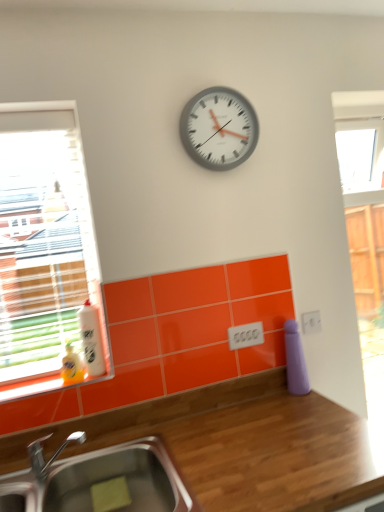
Question: From a real-world perspective, is wooden at upper center physically above clear glass window at left?

Choices:
 (A) yes
 (B) no

Answer: (B)

Question: Is wooden at upper center oriented towards clear glass window at left?

Choices:
 (A) no
 (B) yes

Answer: (A)

Question: From the image's perspective, is wooden at upper center below clear glass window at left?

Choices:
 (A) yes
 (B) no

Answer: (A)

Question: Is wooden at upper center not within clear glass window at left?

Choices:
 (A) yes
 (B) no

Answer: (A)

Question: Does wooden at upper center have a lesser width compared to clear glass window at left?

Choices:
 (A) yes
 (B) no

Answer: (B)

Question: Does point (77, 451) appear closer or farther from the camera than point (163, 446)?

Choices:
 (A) farther
 (B) closer

Answer: (A)

Question: Would you say wooden at upper center is to the left or to the right of stainless steel sink at lower left in the picture?

Choices:
 (A) left
 (B) right

Answer: (B)

Question: Based on their sizes in the image, would you say wooden at upper center is bigger or smaller than stainless steel sink at lower left?

Choices:
 (A) small
 (B) big

Answer: (B)

Question: In terms of width, does wooden at upper center look wider or thinner when compared to stainless steel sink at lower left?

Choices:
 (A) wide
 (B) thin

Answer: (A)

Question: Considering the positions of wooden at upper center and white plastic clock at upper center in the image, is wooden at upper center wider or thinner than white plastic clock at upper center?

Choices:
 (A) thin
 (B) wide

Answer: (B)

Question: From their relative heights in the image, would you say wooden at upper center is taller or shorter than white plastic clock at upper center?

Choices:
 (A) short
 (B) tall

Answer: (B)

Question: From a real-world perspective, is wooden at upper center positioned above or below white plastic clock at upper center?

Choices:
 (A) above
 (B) below

Answer: (B)

Question: Is wooden at upper center situated inside white plastic clock at upper center or outside?

Choices:
 (A) outside
 (B) inside

Answer: (A)

Question: Considering the positions of clear glass window at left and white glossy bottle at left in the image, is clear glass window at left taller or shorter than white glossy bottle at left?

Choices:
 (A) short
 (B) tall

Answer: (B)

Question: Would you say clear glass window at left is inside or outside white glossy bottle at left?

Choices:
 (A) inside
 (B) outside

Answer: (B)